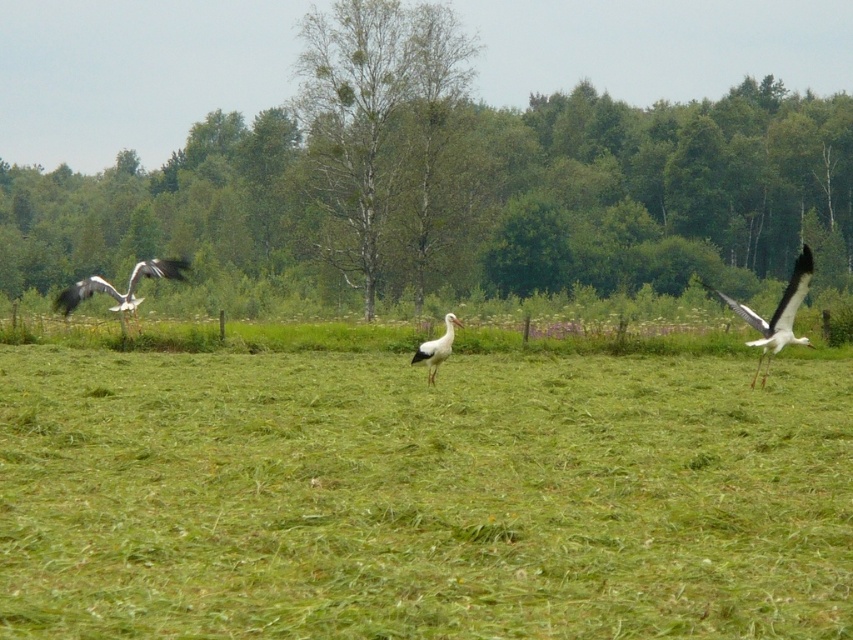
Based on the photo, you are standing in the middle of the field and want to take a photo of both the green grass at center and the green leafy tree at center. Which object will appear larger in the photo?

The green grass at center will appear larger in the photo because it is closer to the viewer than the green leafy tree at center.

You are a photographer aiming to capture the white matte stork at right in your shot. Your camera has a focal length of 50mm and you want to ensure the stork is centered in the frame. Given the stork is at coordinates approximately 0.491 on the x axis and 0.911 on the y axis, will it be centered in your photo?

The white matte stork at right is positioned at coordinates approximately 0.491 on the x axis and 0.911 on the y axis. Since the center of the frame would be at coordinates around 0.5 on both axes, the stork is very close to the center horizontally but slightly lower vertically. It will appear nearly centered but slightly below the exact center.